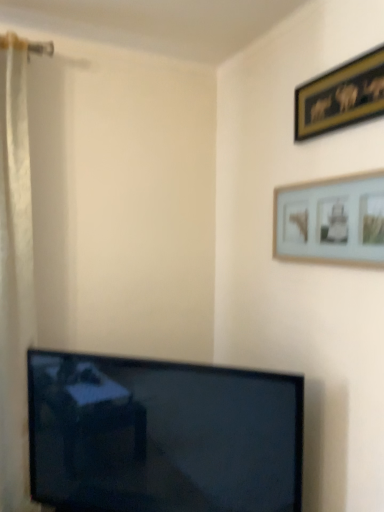
Question: Is gold-framed picture at upper right, the 2th picture frame when ordered from bottom to top, not within white matte picture frame at upper right, the 1th picture frame ordered from the bottom?

Choices:
 (A) yes
 (B) no

Answer: (A)

Question: Can you confirm if gold-framed picture at upper right, the 2th picture frame when ordered from bottom to top, is positioned to the right of white matte picture frame at upper right, the 1th picture frame ordered from the bottom?

Choices:
 (A) no
 (B) yes

Answer: (B)

Question: Is gold-framed picture at upper right, the 2th picture frame when ordered from bottom to top, far away from white matte picture frame at upper right, which is counted as the second picture frame, starting from the top?

Choices:
 (A) no
 (B) yes

Answer: (A)

Question: Does gold-framed picture at upper right, the 1th picture frame viewed from the top, have a lesser width compared to white matte picture frame at upper right, the 1th picture frame ordered from the bottom?

Choices:
 (A) no
 (B) yes

Answer: (B)

Question: From a real-world perspective, does gold-framed picture at upper right, the 2th picture frame when ordered from bottom to top, sit lower than white matte picture frame at upper right, which is counted as the second picture frame, starting from the top?

Choices:
 (A) yes
 (B) no

Answer: (B)

Question: Does gold-framed picture at upper right, the 1th picture frame viewed from the top, lie behind white matte picture frame at upper right, which is counted as the second picture frame, starting from the top?

Choices:
 (A) no
 (B) yes

Answer: (B)

Question: Is white matte picture frame at upper right, the 1th picture frame ordered from the bottom, at the left side of gold-framed picture at upper right, the 1th picture frame viewed from the top?

Choices:
 (A) yes
 (B) no

Answer: (A)

Question: Considering the relative positions of white matte picture frame at upper right, the 1th picture frame ordered from the bottom, and gold-framed picture at upper right, the 2th picture frame when ordered from bottom to top, in the image provided, is white matte picture frame at upper right, the 1th picture frame ordered from the bottom, to the right of gold-framed picture at upper right, the 2th picture frame when ordered from bottom to top, from the viewer's perspective?

Choices:
 (A) no
 (B) yes

Answer: (A)

Question: Would you consider white matte picture frame at upper right, the 1th picture frame ordered from the bottom, to be distant from gold-framed picture at upper right, the 2th picture frame when ordered from bottom to top?

Choices:
 (A) no
 (B) yes

Answer: (A)

Question: Considering the relative sizes of white matte picture frame at upper right, which is counted as the second picture frame, starting from the top, and gold-framed picture at upper right, the 1th picture frame viewed from the top, in the image provided, is white matte picture frame at upper right, which is counted as the second picture frame, starting from the top, shorter than gold-framed picture at upper right, the 1th picture frame viewed from the top,?

Choices:
 (A) yes
 (B) no

Answer: (B)

Question: From the image's perspective, is white matte picture frame at upper right, which is counted as the second picture frame, starting from the top, above gold-framed picture at upper right, the 2th picture frame when ordered from bottom to top?

Choices:
 (A) yes
 (B) no

Answer: (B)

Question: Is white matte picture frame at upper right, the 1th picture frame ordered from the bottom, in front of gold-framed picture at upper right, the 2th picture frame when ordered from bottom to top?

Choices:
 (A) no
 (B) yes

Answer: (B)

Question: Is gold-framed picture at upper right, the 1th picture frame viewed from the top, inside or outside of white matte picture frame at upper right, which is counted as the second picture frame, starting from the top?

Choices:
 (A) inside
 (B) outside

Answer: (B)